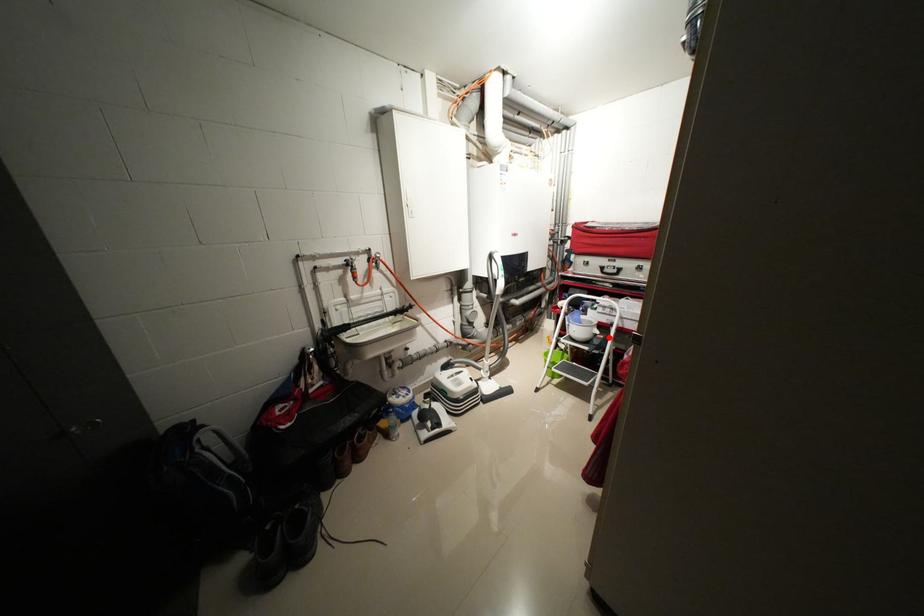
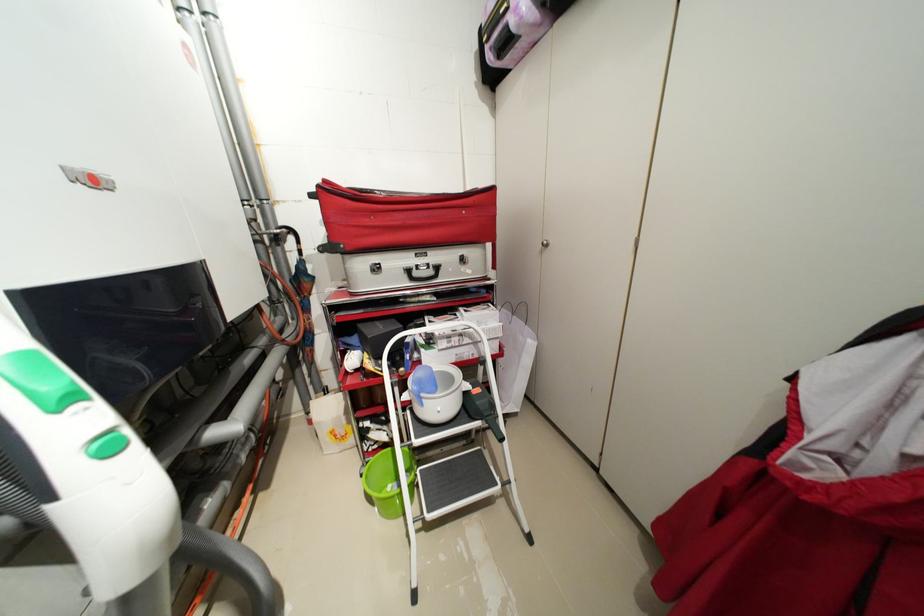
Find the pixel in the second image that matches the highlighted location in the first image.

(484, 391)